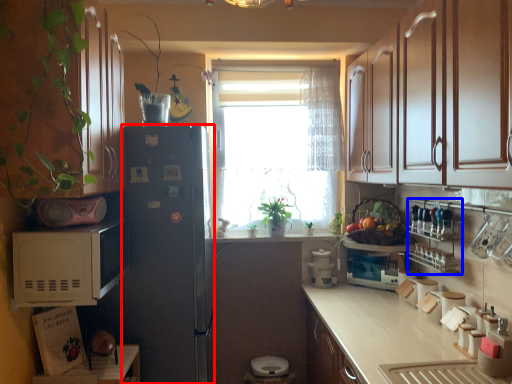
Question: Which object is further to the camera taking this photo, refrigerator (highlighted by a red box) or shelf (highlighted by a blue box)?

Choices:
 (A) refrigerator
 (B) shelf

Answer: (A)